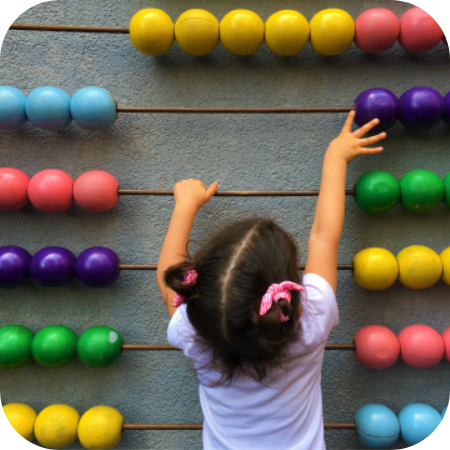
Locate an element on the screen. The height and width of the screenshot is (450, 450). metal horizontal rod for sliding beads is located at coordinates (115, 29), (166, 109), (152, 188), (142, 266), (150, 345), (150, 423).